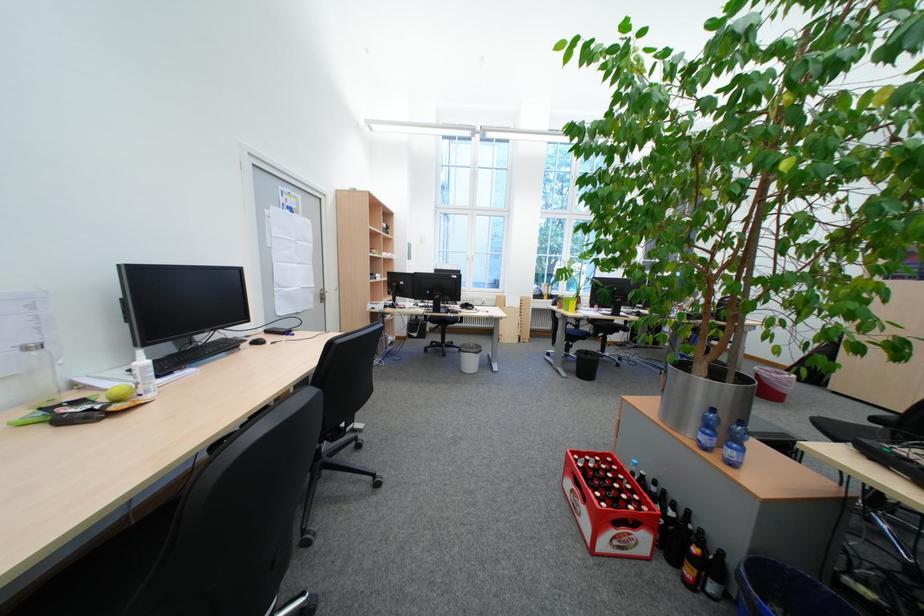
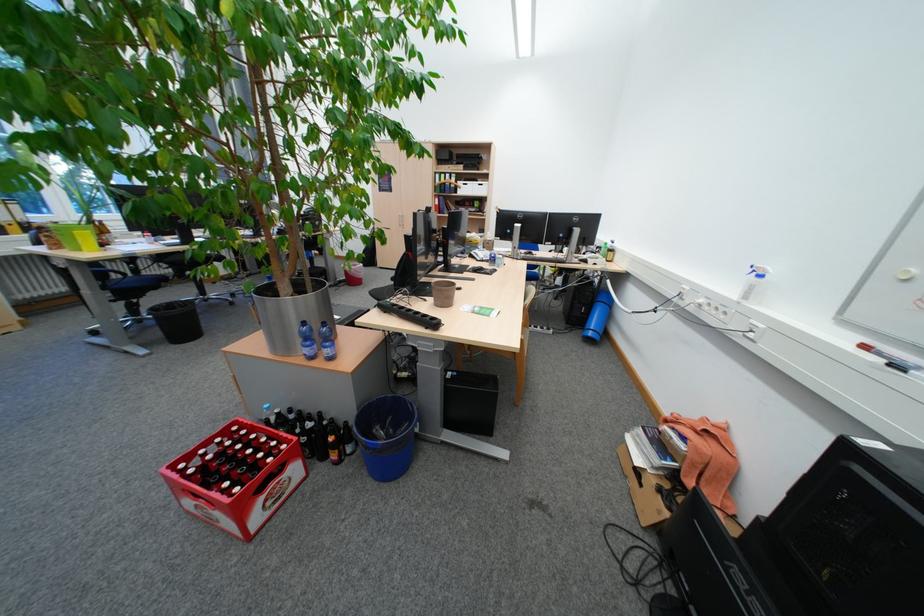
Based on the continuous images, in which direction is the camera rotating?

The camera's rotation is toward right-down.